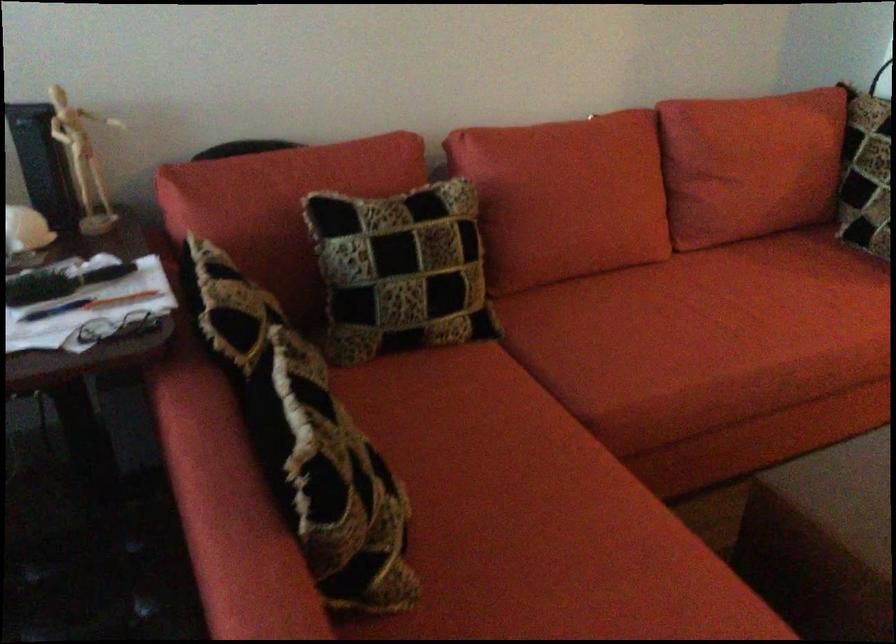
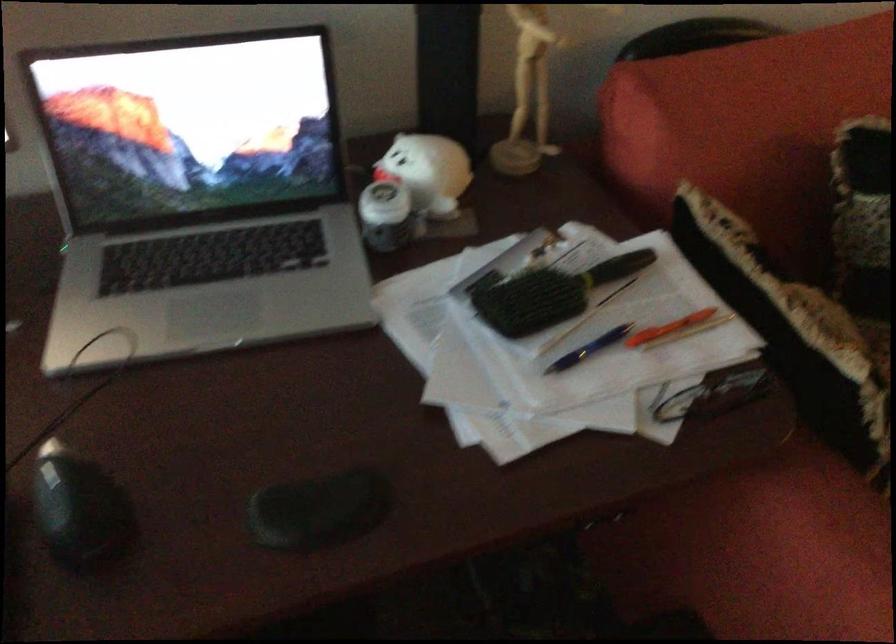
Locate, in the second image, the point that corresponds to [246,181] in the first image.

(746, 96)